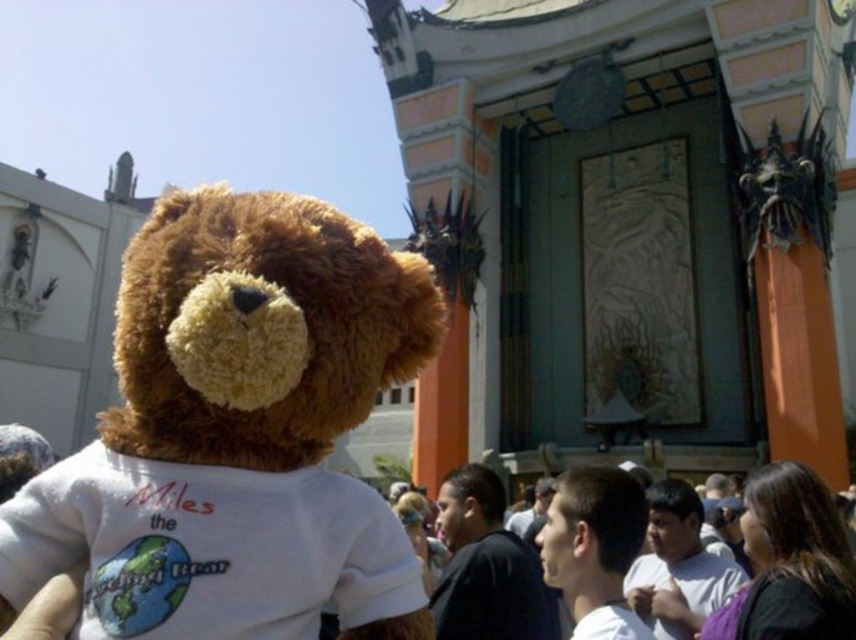
You are a photographer trying to capture a clear shot of the dark brown hair at center without the soft brown teddy bear at center blocking it. Since the teddy bear is wider than the hair, how should you adjust your camera angle to ensure the hair is visible?

Since the soft brown teddy bear at center is wider than the dark brown hair at center, you should position your camera to the side of the teddy bear so that the narrower dark brown hair at center becomes visible without obstruction.

You are a photographer trying to capture a clear shot of the person wearing the white Tshirt with the globe design. The soft brown teddy bear at center and the dark brown hair at center are in the way. Which object should you move to get a better view of the person?

The soft brown teddy bear at center is bigger than the dark brown hair at center, so you should move the soft brown teddy bear at center to get a better view of the person.

You are a photographer trying to capture a clear photo of the dark brown hair at center. However, the soft brown teddy bear at center is blocking your view. Can you move the teddy bear to the side to get a clear shot?

The soft brown teddy bear at center is in front of dark brown hair at center, so moving it to the side would allow you to see the dark brown hair at center clearly.